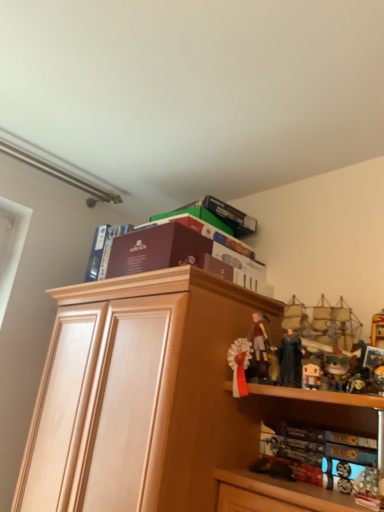
Describe the element at coordinates (323, 456) in the screenshot. I see `hardcover book at lower right, the fourth book positioned from the top` at that location.

Describe the element at coordinates (290, 361) in the screenshot. I see `matte black figurine at upper right` at that location.

This screenshot has width=384, height=512. I want to click on matte brown figurine at center, so click(x=259, y=348).

What is the approximate height of light wood cabinet at center?

31.13 inches.

Where is `matte brown box at upper center, the fourth book in the bottom-to-top sequence`? matte brown box at upper center, the fourth book in the bottom-to-top sequence is located at coordinates (178, 249).

Which object is positioned more to the left, maroon cardboard box at upper center, the 2th book positioned from the bottom, or maroon cardboard book at upper center, which is counted as the 2th book, starting from the top?

From the viewer's perspective, maroon cardboard book at upper center, which is counted as the 2th book, starting from the top, appears more on the left side.

Considering the positions of point (141, 269) and point (102, 231), is point (141, 269) closer or farther from the camera than point (102, 231)?

Point (141, 269) is positioned closer to the camera compared to point (102, 231).

Which is in front, maroon cardboard box at upper center, the 2th book positioned from the bottom, or maroon cardboard book at upper center, which is counted as the 2th book, starting from the top?

maroon cardboard box at upper center, the 2th book positioned from the bottom, is closer to the camera.

Where is `book above the maroon cardboard book at upper center, which appears as the third book when ordered from the bottom (from a real-world perspective)`? The image size is (384, 512). book above the maroon cardboard book at upper center, which appears as the third book when ordered from the bottom (from a real-world perspective) is located at coordinates (178, 249).

Is maroon cardboard book at upper center, which appears as the third book when ordered from the bottom, facing away from matte brown box at upper center, the fourth book in the bottom-to-top sequence?

No, maroon cardboard book at upper center, which appears as the third book when ordered from the bottom, is not facing away from matte brown box at upper center, the fourth book in the bottom-to-top sequence.

Which is more to the left, maroon cardboard book at upper center, which appears as the third book when ordered from the bottom, or matte brown box at upper center, which ranks as the 1th book in top-to-bottom order?

Positioned to the left is maroon cardboard book at upper center, which appears as the third book when ordered from the bottom.

Which object is further away from the camera taking this photo, maroon cardboard book at upper center, which is counted as the 2th book, starting from the top, or matte brown box at upper center, the fourth book in the bottom-to-top sequence?

maroon cardboard book at upper center, which is counted as the 2th book, starting from the top.

Is light wood cabinet at center in front of or behind matte black figurine at upper right in the image?

In the image, light wood cabinet at center appears in front of matte black figurine at upper right.

In the scene shown: Considering the relative positions of light wood cabinet at center and matte black figurine at upper right in the image provided, is light wood cabinet at center to the right of matte black figurine at upper right from the viewer's perspective?

No, light wood cabinet at center is not to the right of matte black figurine at upper right.

Is light wood cabinet at center beside matte black figurine at upper right?

No, light wood cabinet at center is not beside matte black figurine at upper right.

Based on the photo, can you confirm if matte black figurine at upper right is positioned to the right of maroon cardboard box at upper center, marked as the third book in a top-to-bottom arrangement?

Indeed, matte black figurine at upper right is positioned on the right side of maroon cardboard box at upper center, marked as the third book in a top-to-bottom arrangement.

Is matte black figurine at upper right far away from maroon cardboard box at upper center, the 2th book positioned from the bottom?

Actually, matte black figurine at upper right and maroon cardboard box at upper center, the 2th book positioned from the bottom, are a little close together.

Is matte black figurine at upper right wider or thinner than maroon cardboard box at upper center, marked as the third book in a top-to-bottom arrangement?

Considering their sizes, matte black figurine at upper right looks slimmer than maroon cardboard box at upper center, marked as the third book in a top-to-bottom arrangement.

Is matte brown figurine at center positioned before light wood cabinet at center?

No, the depth of matte brown figurine at center is greater than that of light wood cabinet at center.

Is light wood cabinet at center surrounded by matte brown figurine at center?

That's incorrect, light wood cabinet at center is not inside matte brown figurine at center.

Based on the photo, which of these two, matte brown figurine at center or light wood cabinet at center, stands taller?

With more height is light wood cabinet at center.

Does matte brown figurine at center have a larger size compared to light wood cabinet at center?

Actually, matte brown figurine at center might be smaller than light wood cabinet at center.

Which is behind, point (178, 326) or point (370, 464)?

The point (178, 326) is farther from the camera.

Is light wood cabinet at center completely or partially outside of hardcover book at lower right, the fourth book positioned from the top?

That's correct, light wood cabinet at center is outside of hardcover book at lower right, the fourth book positioned from the top.

Is light wood cabinet at center not close to hardcover book at lower right, positioned as the 1th book in bottom-to-top order?

No, there isn't a large distance between light wood cabinet at center and hardcover book at lower right, positioned as the 1th book in bottom-to-top order.

Based on the photo, from the image's perspective, which one is positioned higher, light wood cabinet at center or hardcover book at lower right, the fourth book positioned from the top?

hardcover book at lower right, the fourth book positioned from the top, appears higher in the image.

From their relative heights in the image, would you say light wood cabinet at center is taller or shorter than matte brown box at upper center, which ranks as the 1th book in top-to-bottom order?

light wood cabinet at center is taller than matte brown box at upper center, which ranks as the 1th book in top-to-bottom order.

Would you say light wood cabinet at center is outside matte brown box at upper center, the fourth book in the bottom-to-top sequence?

Yes, light wood cabinet at center is outside of matte brown box at upper center, the fourth book in the bottom-to-top sequence.

From a real-world perspective, between light wood cabinet at center and matte brown box at upper center, which ranks as the 1th book in top-to-bottom order, who is vertically lower?

light wood cabinet at center is physically lower.

Does light wood cabinet at center appear on the right side of matte brown box at upper center, which ranks as the 1th book in top-to-bottom order?

No, light wood cabinet at center is not to the right of matte brown box at upper center, which ranks as the 1th book in top-to-bottom order.

The width and height of the screenshot is (384, 512). There is a maroon cardboard box at upper center, the 2th book positioned from the bottom. Identify the location of the 1st book above it (from a real-world perspective). (103, 250).

In order to click on book that is the 1st one below the matte brown box at upper center, the fourth book in the bottom-to-top sequence (from a real-world perspective) in this screenshot , I will do `click(103, 250)`.

Which object lies further to the anchor point light wood cabinet at center, maroon cardboard book at upper center, which is counted as the 2th book, starting from the top, or matte black figurine at upper right?

Among the two, matte black figurine at upper right is located further to light wood cabinet at center.

Looking at the image, which one is located closer to hardcover book at lower right, the fourth book positioned from the top, maroon cardboard box at upper center, the 2th book positioned from the bottom, or matte brown figurine at center?

matte brown figurine at center.

Which object lies nearer to the anchor point hardcover book at lower right, the fourth book positioned from the top, matte brown box at upper center, which ranks as the 1th book in top-to-bottom order, or maroon cardboard book at upper center, which appears as the third book when ordered from the bottom?

matte brown box at upper center, which ranks as the 1th book in top-to-bottom order, is positioned closer to the anchor hardcover book at lower right, the fourth book positioned from the top.

Based on their spatial positions, is light wood cabinet at center or maroon cardboard box at upper center, marked as the third book in a top-to-bottom arrangement, closer to matte brown box at upper center, the fourth book in the bottom-to-top sequence?

Among the two, maroon cardboard box at upper center, marked as the third book in a top-to-bottom arrangement, is located nearer to matte brown box at upper center, the fourth book in the bottom-to-top sequence.

When comparing their distances from matte black figurine at upper right, does hardcover book at lower right, positioned as the 1th book in bottom-to-top order, or maroon cardboard book at upper center, which appears as the third book when ordered from the bottom, seem further?

Based on the image, maroon cardboard book at upper center, which appears as the third book when ordered from the bottom, appears to be further to matte black figurine at upper right.

Estimate the real-world distances between objects in this image. Which object is closer to maroon cardboard box at upper center, the 2th book positioned from the bottom, hardcover book at lower right, the fourth book positioned from the top, or matte brown figurine at center?

matte brown figurine at center is positioned closer to the anchor maroon cardboard box at upper center, the 2th book positioned from the bottom.

Estimate the real-world distances between objects in this image. Which object is further from light wood cabinet at center, maroon cardboard box at upper center, marked as the third book in a top-to-bottom arrangement, or matte black figurine at upper right?

matte black figurine at upper right lies further to light wood cabinet at center than the other object.

Looking at the image, which one is located further to maroon cardboard book at upper center, which is counted as the 2th book, starting from the top, maroon cardboard box at upper center, the 2th book positioned from the bottom, or matte brown figurine at center?

The object further to maroon cardboard book at upper center, which is counted as the 2th book, starting from the top, is matte brown figurine at center.

Identify the location of person located between maroon cardboard book at upper center, which is counted as the 2th book, starting from the top, and hardcover book at lower right, the fourth book positioned from the top, in the left-right direction. The width and height of the screenshot is (384, 512). (259, 348).

This screenshot has height=512, width=384. What are the coordinates of `person between maroon cardboard box at upper center, the 2th book positioned from the bottom, and matte black figurine at upper right` in the screenshot? It's located at (259, 348).

Identify the location of person between maroon cardboard book at upper center, which appears as the third book when ordered from the bottom, and matte black figurine at upper right, in the horizontal direction. The height and width of the screenshot is (512, 384). (259, 348).

I want to click on person between matte brown box at upper center, which ranks as the 1th book in top-to-bottom order, and hardcover book at lower right, the fourth book positioned from the top, in the vertical direction, so click(259, 348).